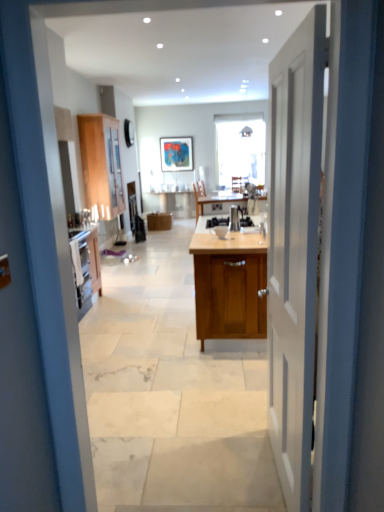
In order to face wooden cabinet at center, the 1th cabinetry in the right-to-left sequence, should I rotate leftwards or rightwards?

Turn right by 6.266 degrees to look at wooden cabinet at center, the 1th cabinetry in the right-to-left sequence.

Image resolution: width=384 pixels, height=512 pixels. I want to click on wooden cabinet at center, the 1th cabinetry viewed from the back, so click(x=159, y=221).

This screenshot has height=512, width=384. What do you see at coordinates (171, 395) in the screenshot?
I see `wooden cabinet at center` at bounding box center [171, 395].

The width and height of the screenshot is (384, 512). Describe the element at coordinates (101, 164) in the screenshot. I see `wooden cabinet at left, the third cabinetry from the right` at that location.

What are the coordinates of `wooden chair at center` in the screenshot? It's located at point(243,183).

Locate an element on the screen. satin silver kettle at center is located at coordinates (234, 218).

This screenshot has height=512, width=384. In order to click on wooden cabinet at center, which is the first cabinetry in front-to-back order in this screenshot , I will do `click(229, 285)`.

Can you confirm if wooden cabinet at center, the 1th cabinetry viewed from the back, is shorter than wooden cabinet at center?

No, wooden cabinet at center, the 1th cabinetry viewed from the back, is not shorter than wooden cabinet at center.

What's the angular difference between wooden cabinet at center, arranged as the second cabinetry when viewed from the right, and wooden cabinet at center's facing directions?

wooden cabinet at center, arranged as the second cabinetry when viewed from the right, and wooden cabinet at center are facing 90.9 degrees away from each other.

Would you say wooden chair at center is inside or outside wooden cabinet at center?

wooden chair at center lies outside wooden cabinet at center.

From a real-world perspective, is wooden chair at center beneath wooden cabinet at center?

No, from a real-world perspective, wooden chair at center is not under wooden cabinet at center.

Is wooden chair at center looking in the opposite direction of wooden cabinet at center?

wooden chair at center does not have its back to wooden cabinet at center.

Can you confirm if wooden chair at center is thinner than wooden cabinet at center?

Correct, the width of wooden chair at center is less than that of wooden cabinet at center.

How much distance is there between wooden cabinet at left, which is the second cabinetry from back to front, and satin silver kettle at center?

They are 8.81 feet apart.

Which of these two, wooden cabinet at left, the first cabinetry from the left, or satin silver kettle at center, is smaller?

Smaller between the two is satin silver kettle at center.

Considering the sizes of wooden cabinet at left, the third cabinetry from the right, and satin silver kettle at center in the image, is wooden cabinet at left, the third cabinetry from the right, taller or shorter than satin silver kettle at center?

In the image, wooden cabinet at left, the third cabinetry from the right, appears to be taller than satin silver kettle at center.

Between wooden cabinet at left, the first cabinetry from the left, and satin silver kettle at center, which one has smaller width?

Thinner between the two is satin silver kettle at center.

From a real-world perspective, does wooden cabinet at center sit lower than wooden cabinet at center, arranged as the second cabinetry when viewed from the right?

Correct, in the physical world, wooden cabinet at center is lower than wooden cabinet at center, arranged as the second cabinetry when viewed from the right.

Which of these two, wooden cabinet at center or wooden cabinet at center, the 1th cabinetry viewed from the back, is bigger?

wooden cabinet at center is bigger.

From the image's perspective, is wooden cabinet at center located above or below wooden cabinet at center, arranged as the second cabinetry when viewed from the right?

wooden cabinet at center is situated lower than wooden cabinet at center, arranged as the second cabinetry when viewed from the right, in the image.

Can you confirm if wooden cabinet at center, the 1th cabinetry in the right-to-left sequence, is shorter than white wooden door at center?

Yes, wooden cabinet at center, the 1th cabinetry in the right-to-left sequence, is shorter than white wooden door at center.

Is wooden cabinet at center, which is the 3th cabinetry from left to right, touching white wooden door at center?

No, wooden cabinet at center, which is the 3th cabinetry from left to right, is not beside white wooden door at center.

Which point is more forward, (219, 302) or (283, 255)?

Positioned in front is point (283, 255).

From the image's perspective, is wooden chair at center above or below wooden cabinet at center, the 3th cabinetry viewed from the back?

Clearly, from the image's perspective, wooden chair at center is above wooden cabinet at center, the 3th cabinetry viewed from the back.

How different are the orientations of wooden chair at center and wooden cabinet at center, the 1th cabinetry in the right-to-left sequence, in degrees?

The angle between the facing direction of wooden chair at center and the facing direction of wooden cabinet at center, the 1th cabinetry in the right-to-left sequence, is 178 degrees.

Between wooden chair at center and wooden cabinet at center, which is the 3th cabinetry from left to right, which one has less height?

wooden chair at center.

Is wooden cabinet at center, which is the 3th cabinetry from front to back, completely or partially inside wooden cabinet at left, which appears as the second cabinetry when viewed from the front?

That's incorrect, wooden cabinet at center, which is the 3th cabinetry from front to back, is not inside wooden cabinet at left, which appears as the second cabinetry when viewed from the front.

Between wooden cabinet at left, the first cabinetry from the left, and wooden cabinet at center, arranged as the second cabinetry when viewed from the right, which one has larger width?

wooden cabinet at center, arranged as the second cabinetry when viewed from the right, is wider.

From a real-world perspective, is wooden cabinet at left, which is the second cabinetry from back to front, positioned under wooden cabinet at center, which is the 3th cabinetry from front to back, based on gravity?

No.

From the image's perspective, is wooden cabinet at left, the first cabinetry from the left, on wooden cabinet at center, the 1th cabinetry viewed from the back?

Indeed, from the image's perspective, wooden cabinet at left, the first cabinetry from the left, is shown above wooden cabinet at center, the 1th cabinetry viewed from the back.

Where is `plain below the wooden cabinet at center, arranged as the second cabinetry when viewed from the right (from a real-world perspective)`? Image resolution: width=384 pixels, height=512 pixels. plain below the wooden cabinet at center, arranged as the second cabinetry when viewed from the right (from a real-world perspective) is located at coordinates (171, 395).

You are a GUI agent. You are given a task and a screenshot of the screen. Output one action in this format:
    pyautogui.click(x=<x>, y=<y>)
    Task: Click on the chair on the right of wooden cabinet at center
    This screenshot has height=512, width=384.
    Given the screenshot: What is the action you would take?
    (243, 183)

From the image, which object appears to be farther from wooden cabinet at center, the second cabinetry when ordered from left to right, satin silver kettle at center or wooden cabinet at left, which is the second cabinetry from back to front?

Based on the image, satin silver kettle at center appears to be further to wooden cabinet at center, the second cabinetry when ordered from left to right.

Which object lies nearer to the anchor point satin silver kettle at center, wooden cabinet at center, which is the first cabinetry in front-to-back order, or wooden cabinet at center?

wooden cabinet at center, which is the first cabinetry in front-to-back order, lies closer to satin silver kettle at center than the other object.

From the image, which object appears to be nearer to white wooden door at center, satin silver kettle at center or wooden cabinet at center?

Based on the image, wooden cabinet at center appears to be nearer to white wooden door at center.

Considering their positions, is wooden cabinet at center, which is the 3th cabinetry from front to back, positioned further to wooden cabinet at center than satin silver kettle at center?

Based on the image, wooden cabinet at center, which is the 3th cabinetry from front to back, appears to be further to wooden cabinet at center.

Considering their positions, is wooden cabinet at center, which is the 3th cabinetry from front to back, positioned closer to white wooden door at center than wooden cabinet at left, which appears as the second cabinetry when viewed from the front?

wooden cabinet at left, which appears as the second cabinetry when viewed from the front, is closer to white wooden door at center.

Estimate the real-world distances between objects in this image. Which object is closer to wooden chair at center, wooden cabinet at center or wooden cabinet at left, the first cabinetry from the left?

wooden cabinet at left, the first cabinetry from the left.

Looking at the image, which one is located further to wooden cabinet at center, the 1th cabinetry in the right-to-left sequence, wooden cabinet at center, which is the 3th cabinetry from front to back, or wooden cabinet at left, which appears as the second cabinetry when viewed from the front?

Based on the image, wooden cabinet at center, which is the 3th cabinetry from front to back, appears to be further to wooden cabinet at center, the 1th cabinetry in the right-to-left sequence.

When comparing their distances from wooden cabinet at left, which is the second cabinetry from back to front, does wooden chair at center or white wooden door at center seem closer?

wooden chair at center.

Where is `cabinetry between white wooden door at center and wooden cabinet at left, the first cabinetry from the left, from front to back`? cabinetry between white wooden door at center and wooden cabinet at left, the first cabinetry from the left, from front to back is located at coordinates (229, 285).

Locate an element on the screen. The image size is (384, 512). chair between white wooden door at center and wooden cabinet at center, arranged as the second cabinetry when viewed from the right, in the front-back direction is located at coordinates (243, 183).

The width and height of the screenshot is (384, 512). I want to click on cabinetry between wooden cabinet at center and wooden cabinet at left, which is the second cabinetry from back to front, along the z-axis, so click(x=229, y=285).

Where is `cabinetry located between wooden cabinet at center and satin silver kettle at center in the depth direction`? cabinetry located between wooden cabinet at center and satin silver kettle at center in the depth direction is located at coordinates (229, 285).